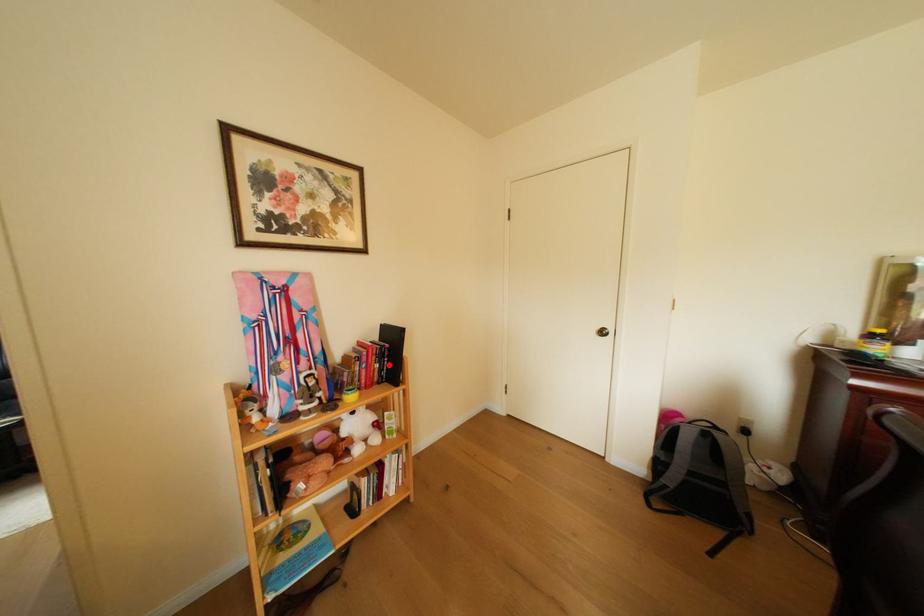
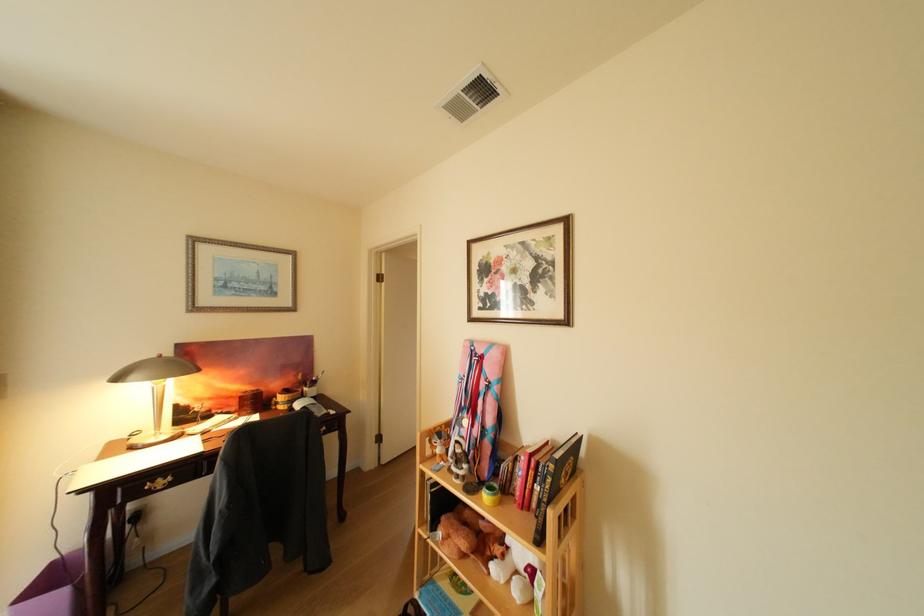
The point at the highlighted location is marked in the first image. Where is the corresponding point in the second image?

(548, 484)